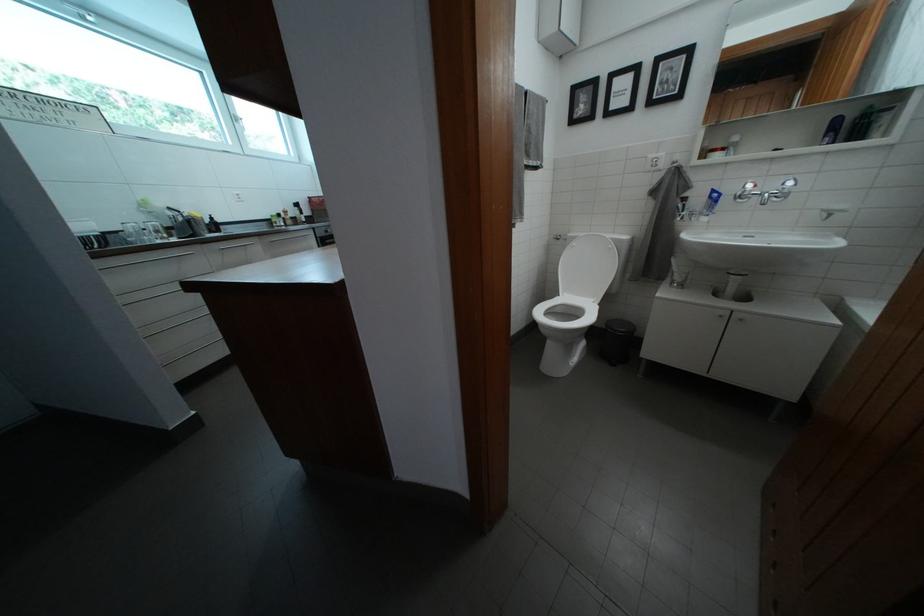
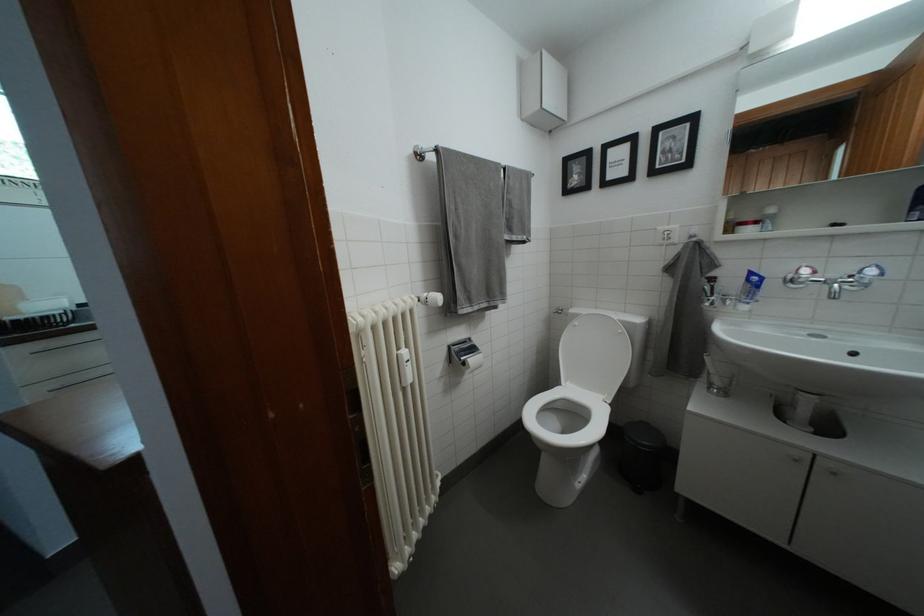
In the second image, find the point that corresponds to [723,197] in the first image.

(760, 280)